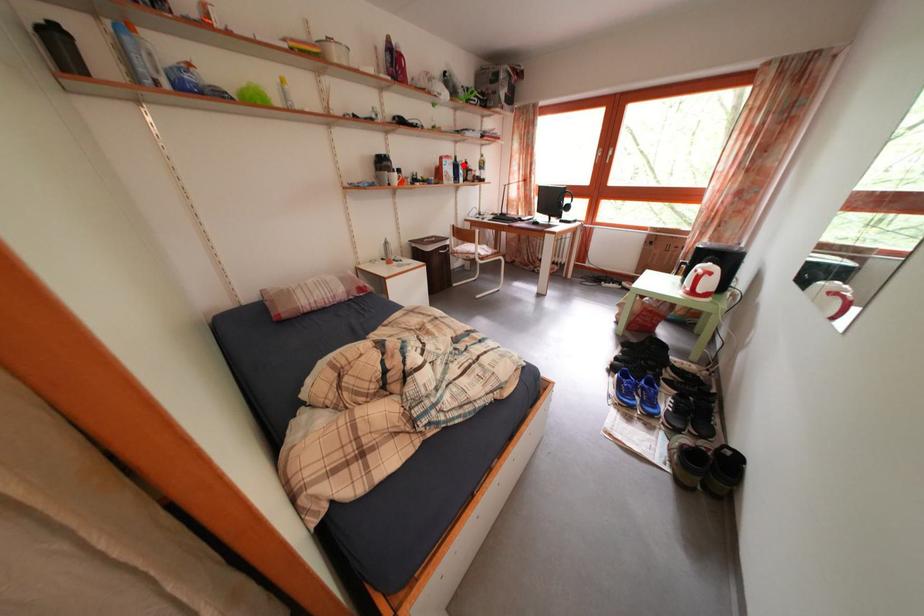
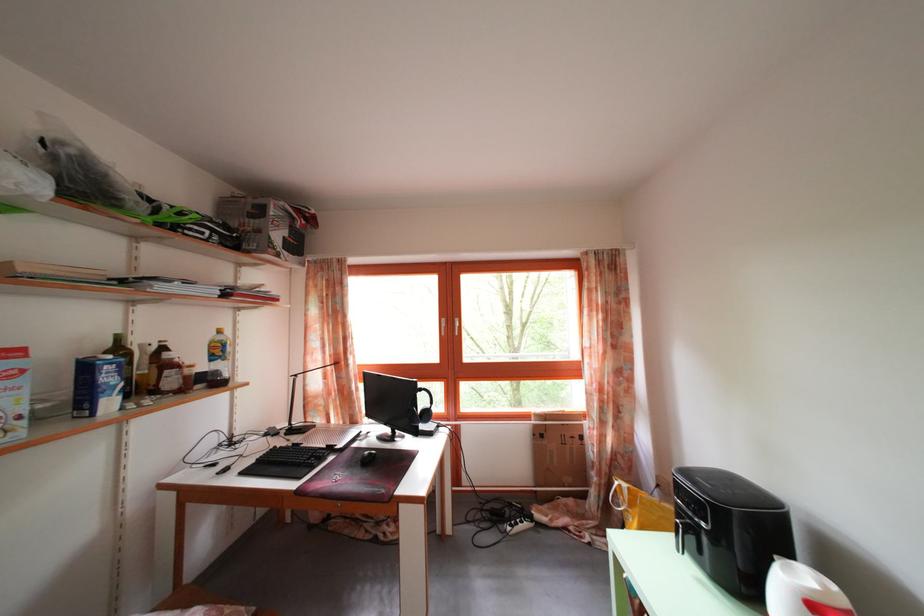
The point at the highlighted location is marked in the first image. Where is the corresponding point in the second image?

(126, 346)